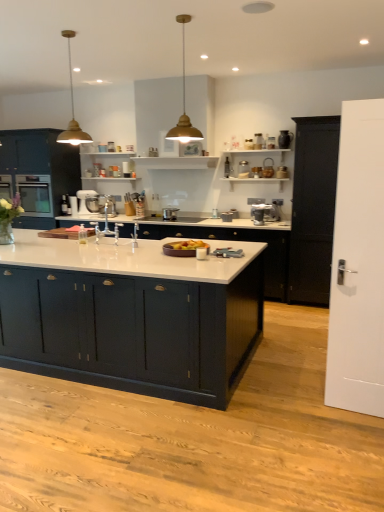
Question: From the image's perspective, is satin black oven at left located beneath metallic silver stand mixer at center, the 6th appliance from the right?

Choices:
 (A) no
 (B) yes

Answer: (A)

Question: Can you confirm if satin black oven at left is bigger than metallic silver stand mixer at center, the 6th appliance from the right?

Choices:
 (A) no
 (B) yes

Answer: (B)

Question: From a real-world perspective, is satin black oven at left over metallic silver stand mixer at center, the 6th appliance from the right?

Choices:
 (A) yes
 (B) no

Answer: (A)

Question: Is satin black oven at left to the left of metallic silver stand mixer at center, which ranks as the first appliance in left-to-right order, from the viewer's perspective?

Choices:
 (A) yes
 (B) no

Answer: (A)

Question: Is satin black oven at left surrounding metallic silver stand mixer at center, which ranks as the first appliance in left-to-right order?

Choices:
 (A) no
 (B) yes

Answer: (A)

Question: Is gold metal pendant light at upper center, which is the first light fixture from left to right, taller or shorter than matte black kettle at upper right, which is the 6th appliance from left to right?

Choices:
 (A) tall
 (B) short

Answer: (A)

Question: Is gold metal pendant light at upper center, acting as the second light fixture starting from the right, in front of or behind matte black kettle at upper right, the 1th appliance viewed from the right, in the image?

Choices:
 (A) front
 (B) behind

Answer: (A)

Question: From a real-world perspective, is gold metal pendant light at upper center, which is the first light fixture from left to right, physically located above or below matte black kettle at upper right, the 1th appliance viewed from the right?

Choices:
 (A) below
 (B) above

Answer: (B)

Question: Would you say gold metal pendant light at upper center, which is the first light fixture from left to right, is to the left or to the right of matte black kettle at upper right, the 1th appliance viewed from the right, in the picture?

Choices:
 (A) right
 (B) left

Answer: (B)

Question: Considering the positions of gold metallic pendant light at upper center, the 1th light fixture viewed from the right, and white glossy countertop at center, which appears as the 3th cabinetry when viewed from the front, in the image, is gold metallic pendant light at upper center, the 1th light fixture viewed from the right, taller or shorter than white glossy countertop at center, which appears as the 3th cabinetry when viewed from the front,?

Choices:
 (A) tall
 (B) short

Answer: (B)

Question: Looking at their shapes, would you say gold metallic pendant light at upper center, which is the second light fixture from left to right, is wider or thinner than white glossy countertop at center, which ranks as the 2th cabinetry in back-to-front order?

Choices:
 (A) thin
 (B) wide

Answer: (A)

Question: From a real-world perspective, relative to white glossy countertop at center, which ranks as the 2th cabinetry in back-to-front order, is gold metallic pendant light at upper center, which is the second light fixture from left to right, vertically above or below?

Choices:
 (A) below
 (B) above

Answer: (B)

Question: From the image's perspective, is gold metallic pendant light at upper center, the 1th light fixture viewed from the right, above or below white glossy countertop at center, which appears as the 3th cabinetry when viewed from the front?

Choices:
 (A) below
 (B) above

Answer: (B)

Question: Considering their positions, is silver metallic pot at center, marked as the third appliance in a left-to-right arrangement, located in front of or behind white glossy countertop at center, which ranks as the 2th cabinetry in back-to-front order?

Choices:
 (A) front
 (B) behind

Answer: (B)

Question: Choose the correct answer: Is silver metallic pot at center, marked as the third appliance in a left-to-right arrangement, inside white glossy countertop at center, which appears as the 3th cabinetry when viewed from the front, or outside it?

Choices:
 (A) inside
 (B) outside

Answer: (A)